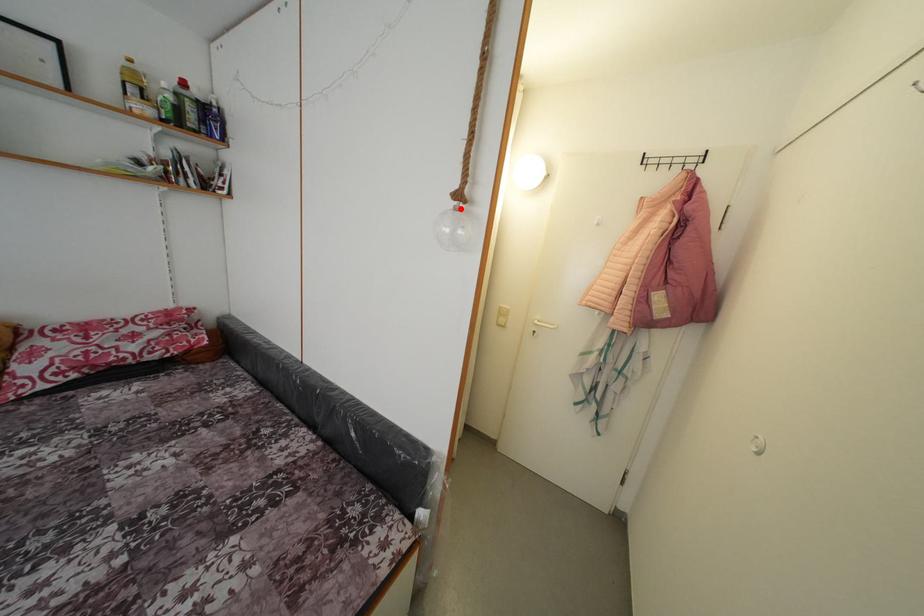
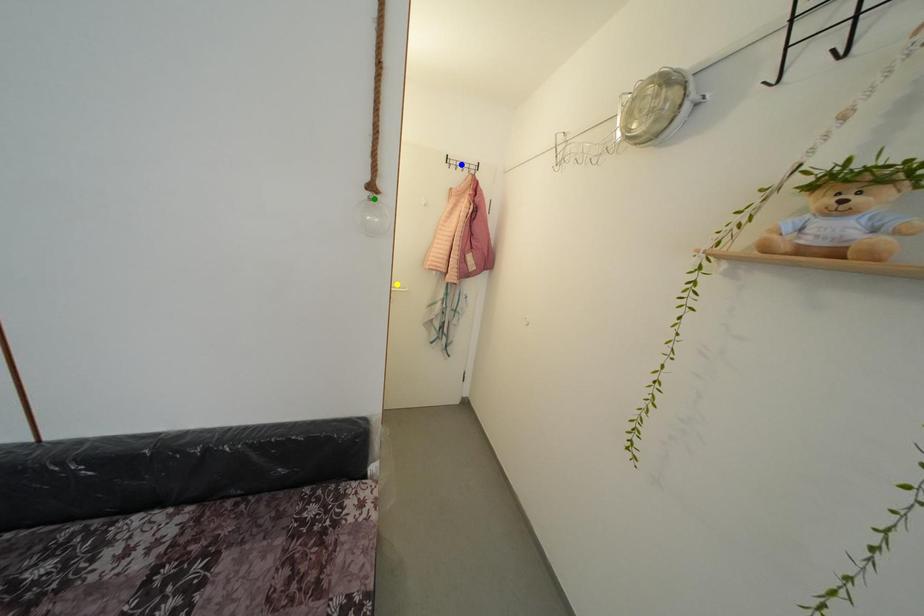
Question: I am providing you with two images of the same scene from different viewpoints. A red point is marked on the first image. You are given multiple points on the second image. Can you choose the point in image 2 that corresponds to the point in image 1?

Choices:
 (A) green point
 (B) blue point
 (C) yellow point

Answer: (A)